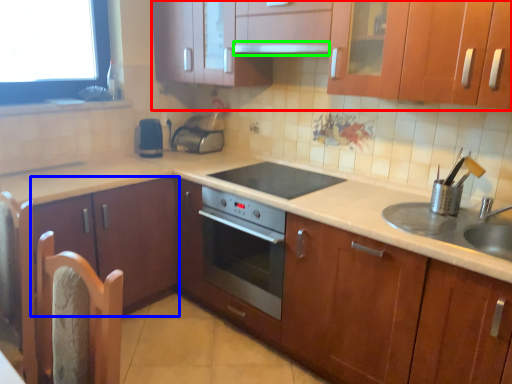
Question: Estimate the real-world distances between objects in this image. Which object is farther from cabinetry (highlighted by a red box), cabinetry (highlighted by a blue box) or exhaust hood (highlighted by a green box)?

Choices:
 (A) cabinetry
 (B) exhaust hood

Answer: (A)